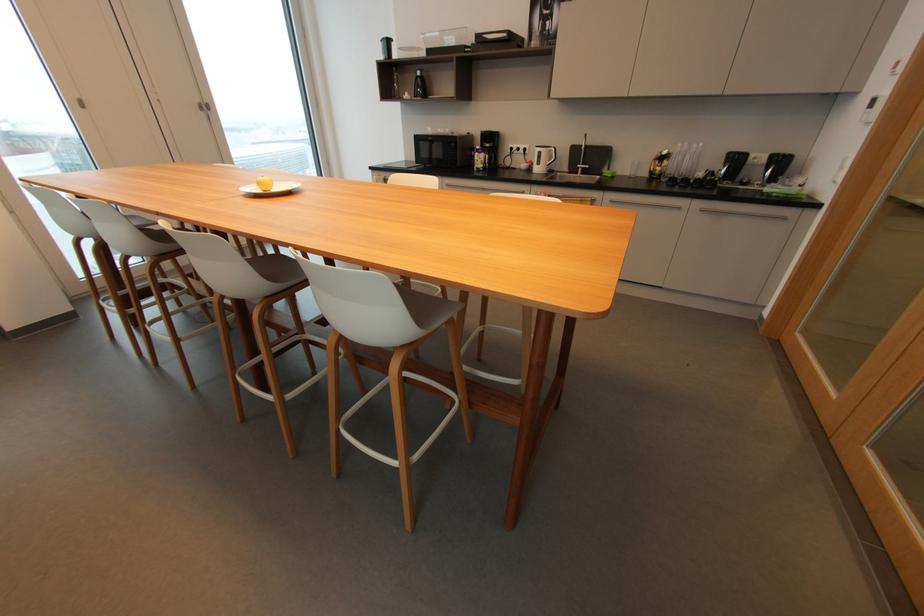
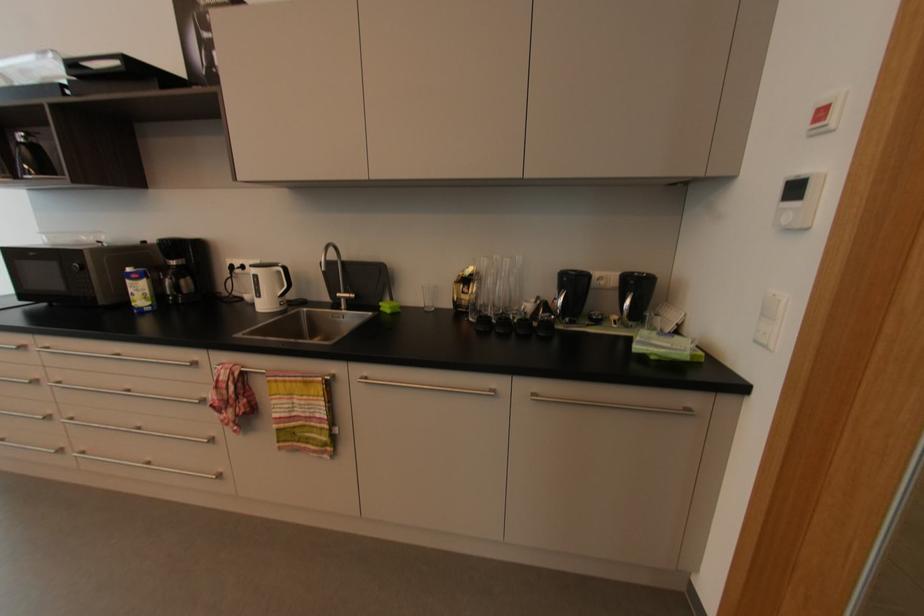
The point at (608,175) is marked in the first image. Where is the corresponding point in the second image?

(384, 309)